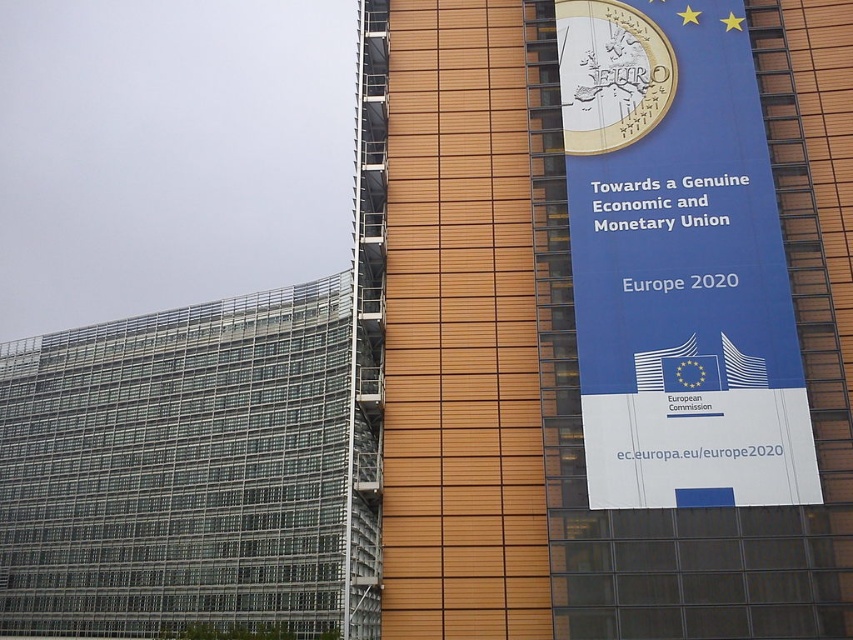
You are standing in front of the building and want to locate two specific points on the facade. The first point is at coordinates point (418, 634) and the second is at point (654, 244). Which point is closer to you?

Point (418, 634) is in front of point (654, 244), so the first point is closer to you.

You are a visitor standing in front of the building and see the blue fabric banner at upper center and the blue paper banner at upper right. Which banner is closer to your left side?

The blue fabric banner at upper center is closer to your left side because it is positioned on the left side of the blue paper banner at upper right.

You are a drone operator tasked with photographing the building facade. The drone has a camera with a 50mm lens. To capture the blue fabric banner at upper center clearly, where should you position the drone relative to the building? Please provide coordinates based on the image dimensions where the banner is located at point 0.494, 0.714.

The blue fabric banner at upper center is located at coordinates (x=608, y=316). To capture it clearly with a 50mm lens, position the drone so the camera is centered on these coordinates, ensuring the banner is at the focal point of the image.